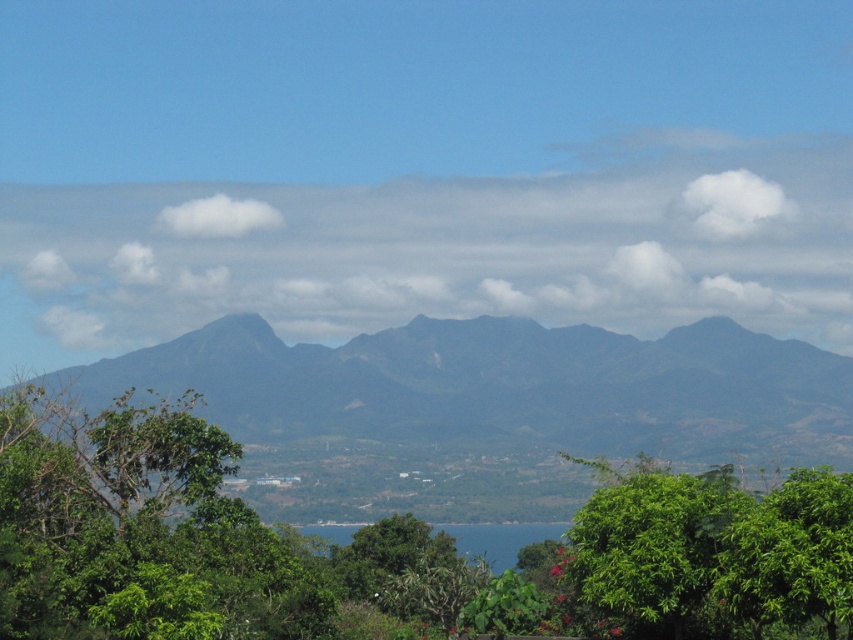
Question: Can you confirm if green leafy tree at center is wider than green leafy tree at lower right?

Choices:
 (A) yes
 (B) no

Answer: (A)

Question: Is green leafy tree at lower right thinner than blue water at lower center?

Choices:
 (A) yes
 (B) no

Answer: (A)

Question: Among these objects, which one is farthest from the camera?

Choices:
 (A) green leafy tree at lower left
 (B) green leafy tree at lower right
 (C) blue water at lower center

Answer: (C)

Question: Which object appears farthest from the camera in this image?

Choices:
 (A) green matte mountain at center
 (B) green leafy tree at lower right
 (C) blue water at lower center

Answer: (A)

Question: From the image, what is the correct spatial relationship of green leafy tree at center in relation to blue water at lower center?

Choices:
 (A) left
 (B) right

Answer: (A)

Question: Which object is positioned farthest from the green matte mountain at center?

Choices:
 (A) blue water at lower center
 (B) green leafy tree at lower right

Answer: (B)